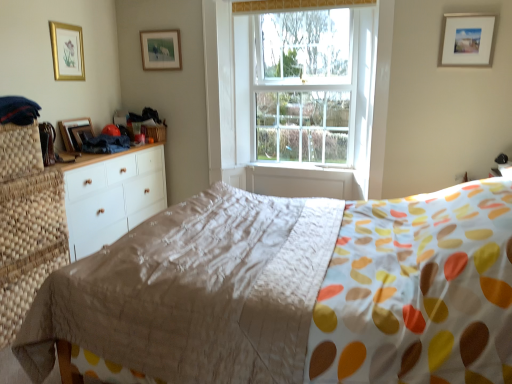
Question: From a real-world perspective, is clear glass window at center positioned under white matte picture frame at upper right, the first picture frame positioned from the right, based on gravity?

Choices:
 (A) yes
 (B) no

Answer: (A)

Question: From the image's perspective, is clear glass window at center beneath white matte picture frame at upper right, placed as the fourth picture frame when sorted from left to right?

Choices:
 (A) no
 (B) yes

Answer: (B)

Question: Is clear glass window at center looking in the opposite direction of white matte picture frame at upper right, placed as the fourth picture frame when sorted from left to right?

Choices:
 (A) no
 (B) yes

Answer: (A)

Question: Does clear glass window at center have a greater width compared to white matte picture frame at upper right, placed as the fourth picture frame when sorted from left to right?

Choices:
 (A) no
 (B) yes

Answer: (B)

Question: Is the position of clear glass window at center less distant than that of white matte picture frame at upper right, placed as the fourth picture frame when sorted from left to right?

Choices:
 (A) yes
 (B) no

Answer: (B)

Question: Based on their sizes in the image, would you say white matte picture frame at upper right, placed as the fourth picture frame when sorted from left to right, is bigger or smaller than matte gold picture frame at upper center, positioned as the second picture frame in right-to-left order?

Choices:
 (A) small
 (B) big

Answer: (B)

Question: Is white matte picture frame at upper right, placed as the fourth picture frame when sorted from left to right, taller or shorter than matte gold picture frame at upper center, positioned as the second picture frame in right-to-left order?

Choices:
 (A) tall
 (B) short

Answer: (A)

Question: From a real-world perspective, relative to matte gold picture frame at upper center, positioned as the second picture frame in right-to-left order, is white matte picture frame at upper right, the first picture frame positioned from the right, vertically above or below?

Choices:
 (A) below
 (B) above

Answer: (A)

Question: In terms of width, does white matte picture frame at upper right, the first picture frame positioned from the right, look wider or thinner when compared to matte gold picture frame at upper center, positioned as the second picture frame in right-to-left order?

Choices:
 (A) wide
 (B) thin

Answer: (A)

Question: Considering the positions of matte beige quilt at center and matte gold picture frame at upper center, the third picture frame when ordered from left to right, in the image, is matte beige quilt at center bigger or smaller than matte gold picture frame at upper center, the third picture frame when ordered from left to right,?

Choices:
 (A) big
 (B) small

Answer: (A)

Question: Considering the positions of matte beige quilt at center and matte gold picture frame at upper center, the third picture frame when ordered from left to right, in the image, is matte beige quilt at center taller or shorter than matte gold picture frame at upper center, the third picture frame when ordered from left to right,?

Choices:
 (A) tall
 (B) short

Answer: (A)

Question: Is point (153, 276) positioned closer to the camera than point (154, 36)?

Choices:
 (A) farther
 (B) closer

Answer: (B)

Question: Would you say matte beige quilt at center is to the left or to the right of matte gold picture frame at upper center, positioned as the second picture frame in right-to-left order, in the picture?

Choices:
 (A) right
 (B) left

Answer: (A)

Question: In terms of size, does gold-framed picture at upper left, arranged as the first picture frame when viewed from the left, appear bigger or smaller than wooden picture frame at left, the 2th picture frame from the left?

Choices:
 (A) big
 (B) small

Answer: (B)

Question: From a real-world perspective, is gold-framed picture at upper left, arranged as the first picture frame when viewed from the left, above or below wooden picture frame at left, the 2th picture frame from the left?

Choices:
 (A) below
 (B) above

Answer: (B)